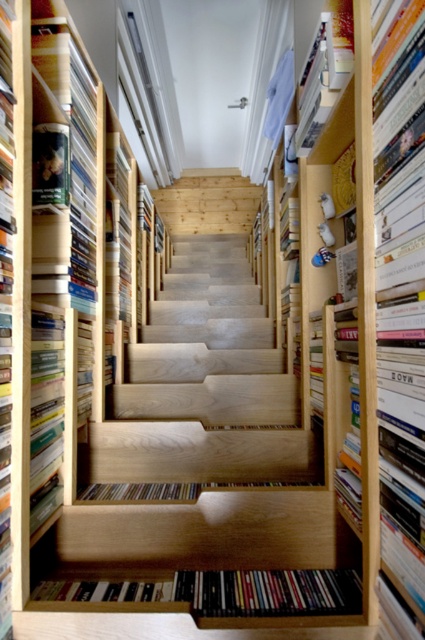
Between natural wood stairs at center and hardcover book at center, which one is positioned lower?

natural wood stairs at center is below.

The width and height of the screenshot is (425, 640). Identify the location of natural wood stairs at center. (195, 452).

Does light brown wood bookshelf at center have a larger size compared to hardcover book at center?

Yes.

Who is shorter, light brown wood bookshelf at center or hardcover book at center?

hardcover book at center is shorter.

The height and width of the screenshot is (640, 425). In order to click on light brown wood bookshelf at center in this screenshot , I will do `click(48, 275)`.

Locate an element on the screen. Image resolution: width=425 pixels, height=640 pixels. light brown wood bookshelf at center is located at coordinates (48, 275).

Is natural wood stairs at center above light brown wood bookshelf at center?

No.

Who is positioned more to the left, natural wood stairs at center or light brown wood bookshelf at center?

light brown wood bookshelf at center is more to the left.

The height and width of the screenshot is (640, 425). In order to click on natural wood stairs at center in this screenshot , I will do `click(195, 452)`.